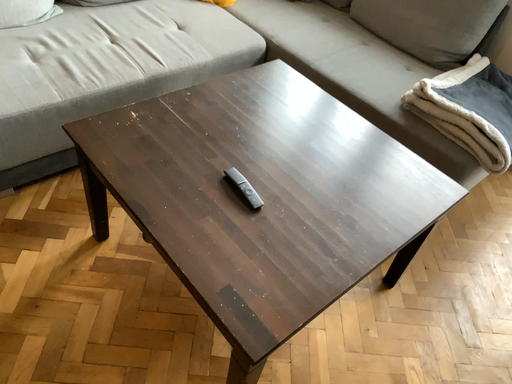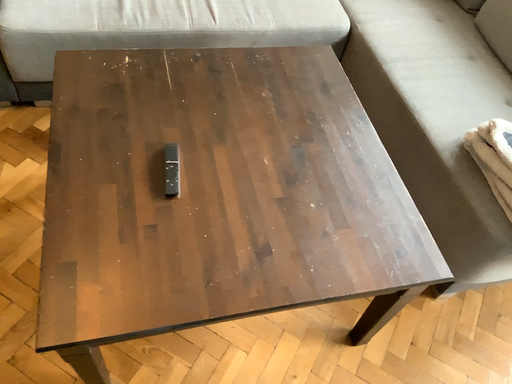
Question: Which way did the camera rotate in the video?

Choices:
 (A) rotated left
 (B) rotated right

Answer: (A)